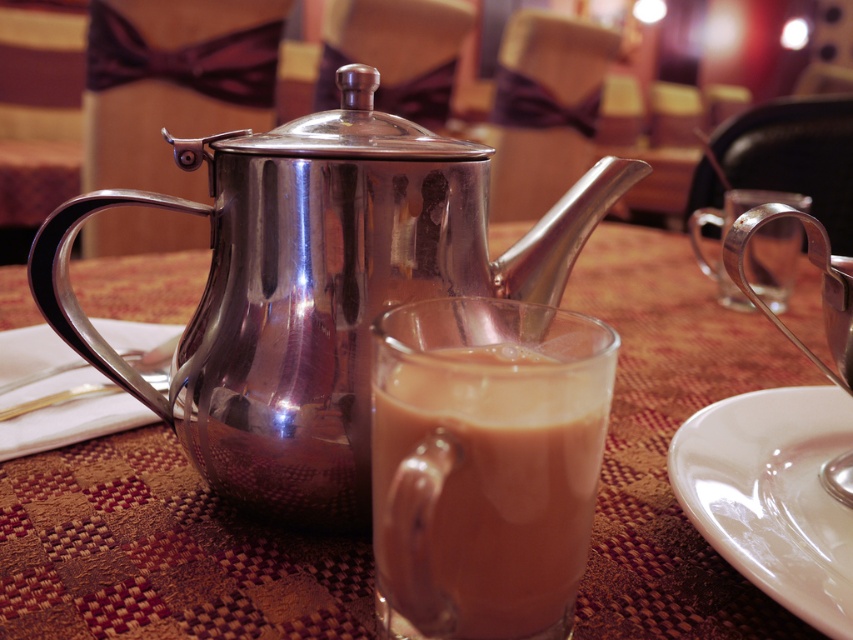
You are a customer at this cozy restaurant and want to reach for the white glossy saucer at lower right. Which direction should you move your hand from the brushed metal teapot at center to get it?

To reach the white glossy saucer at lower right from the brushed metal teapot at center, you should move your hand to the right since the saucer is positioned to the right of the teapot.

In the scene shown: You are a barista trying to place a new cup of coffee on the table. The table has the brushed metal teapot at center and the brown frothy liquid at center. Which object should you move to make space?

The brown frothy liquid at center has a smaller width than the brushed metal teapot at center, so you should move the brown frothy liquid at center to make space for the new cup of coffee.

You are a customer at this restaurant and want to pour the brown frothy liquid at center into the white glossy saucer at lower right. Based on their sizes, do you think the saucer can hold all the liquid without spilling?

The brown frothy liquid at center is much taller than the white glossy saucer at lower right, so pouring the liquid into the saucer would likely cause it to overflow and spill.